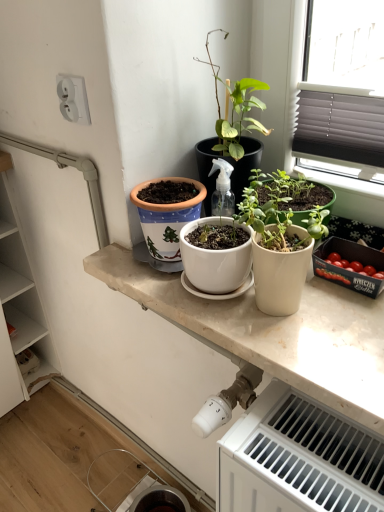
Question: Is green matte plant at center completely or partially outside of white glossy countertop at center?

Choices:
 (A) no
 (B) yes

Answer: (B)

Question: Considering the relative sizes of green matte plant at center and white glossy countertop at center in the image provided, is green matte plant at center smaller than white glossy countertop at center?

Choices:
 (A) yes
 (B) no

Answer: (B)

Question: Is green matte plant at center further to camera compared to white glossy countertop at center?

Choices:
 (A) yes
 (B) no

Answer: (A)

Question: Does green matte plant at center lie in front of white glossy countertop at center?

Choices:
 (A) no
 (B) yes

Answer: (A)

Question: From a real-world perspective, is green matte plant at center physically below white glossy countertop at center?

Choices:
 (A) no
 (B) yes

Answer: (A)

Question: Is green matte plant at center facing away from white glossy countertop at center?

Choices:
 (A) yes
 (B) no

Answer: (B)

Question: Does terracotta clay pot at center come in front of white glossy countertop at center?

Choices:
 (A) yes
 (B) no

Answer: (B)

Question: Considering the relative positions of terracotta clay pot at center and white glossy countertop at center in the image provided, is terracotta clay pot at center to the left of white glossy countertop at center from the viewer's perspective?

Choices:
 (A) yes
 (B) no

Answer: (A)

Question: Is the surface of terracotta clay pot at center in direct contact with white glossy countertop at center?

Choices:
 (A) no
 (B) yes

Answer: (A)

Question: Could white glossy countertop at center be considered to be inside terracotta clay pot at center?

Choices:
 (A) yes
 (B) no

Answer: (B)

Question: Is terracotta clay pot at center located outside white glossy countertop at center?

Choices:
 (A) yes
 (B) no

Answer: (A)

Question: Considering the relative positions of terracotta clay pot at center and white glossy countertop at center in the image provided, is terracotta clay pot at center to the right of white glossy countertop at center from the viewer's perspective?

Choices:
 (A) yes
 (B) no

Answer: (B)

Question: Considering the relative sizes of white glossy countertop at center and white plastic radiator at lower right in the image provided, is white glossy countertop at center thinner than white plastic radiator at lower right?

Choices:
 (A) yes
 (B) no

Answer: (B)